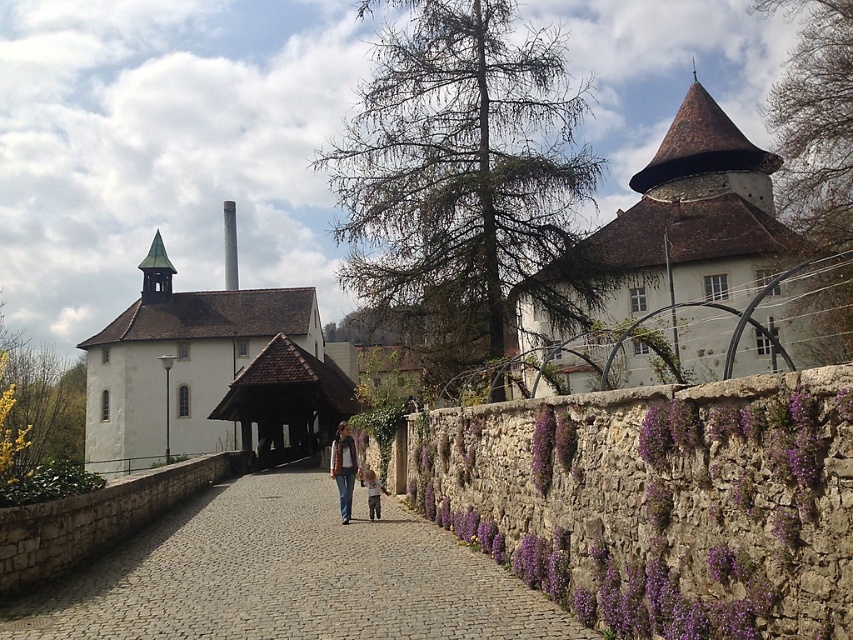
Question: Is denim jacket at center further to camera compared to smooth white spire at upper center?

Choices:
 (A) yes
 (B) no

Answer: (B)

Question: Which object is closer to the camera taking this photo?

Choices:
 (A) brown tiled roof at upper right
 (B) light brown leather jacket at center
 (C) white matte church at left
 (D) denim jacket at center

Answer: (A)

Question: Does gray cobblestone path at center appear on the right side of light brown leather jacket at center?

Choices:
 (A) yes
 (B) no

Answer: (B)

Question: Which point appears closest to the camera in this image?

Choices:
 (A) (140, 550)
 (B) (192, 449)
 (C) (756, 339)
 (D) (332, 465)

Answer: (A)

Question: Can you confirm if smooth white spire at upper center is wider than light brown leather jacket at center?

Choices:
 (A) yes
 (B) no

Answer: (A)

Question: Which object is the closest to the denim jacket at center?

Choices:
 (A) brown tiled roof at upper right
 (B) gray cobblestone path at center

Answer: (B)